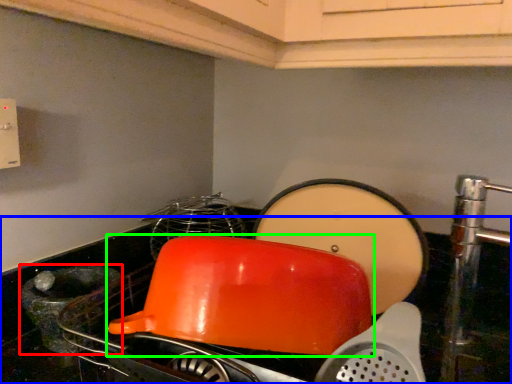
Question: Considering the real-world distances, which object is closest to appliance (highlighted by a red box)? counter top (highlighted by a blue box) or kitchen appliance (highlighted by a green box).

Choices:
 (A) counter top
 (B) kitchen appliance

Answer: (A)